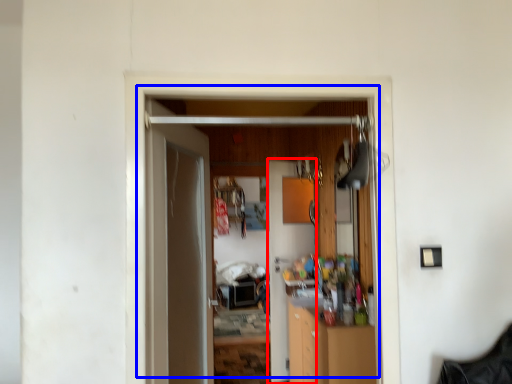
Question: Among these objects, which one is nearest to the camera, door (highlighted by a red box) or door (highlighted by a blue box)?

Choices:
 (A) door
 (B) door

Answer: (B)